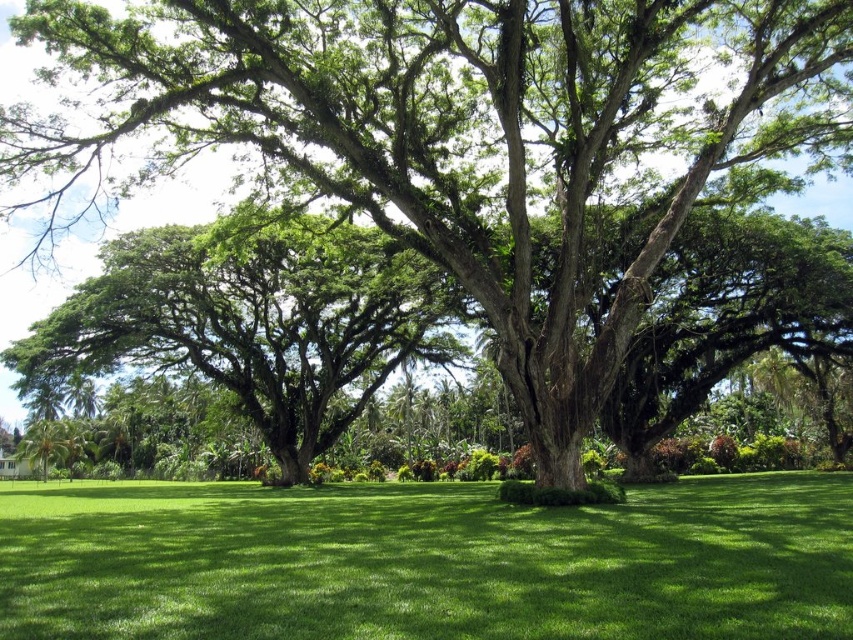
Question: Is green grass at center positioned in front of green leafy tree at center?

Choices:
 (A) yes
 (B) no

Answer: (A)

Question: Is green grass at center to the left of green leafy tree at center from the viewer's perspective?

Choices:
 (A) yes
 (B) no

Answer: (B)

Question: Can you confirm if green grass at center is wider than green leafy tree at center?

Choices:
 (A) no
 (B) yes

Answer: (B)

Question: Which point is closer to the camera taking this photo?

Choices:
 (A) (706, 600)
 (B) (184, 305)

Answer: (A)

Question: Which point is farther from the camera taking this photo?

Choices:
 (A) (387, 260)
 (B) (12, 570)

Answer: (A)